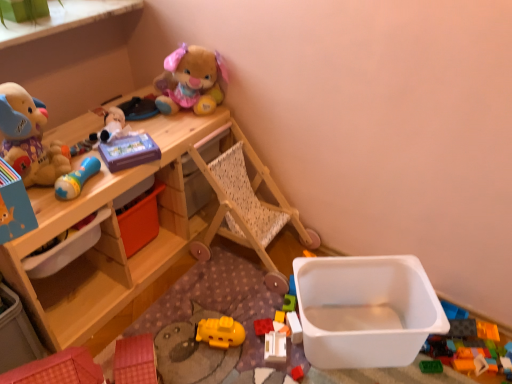
Identify the location of free space behind rubberized red block at center, the second toy from the bottom. click(x=256, y=298).